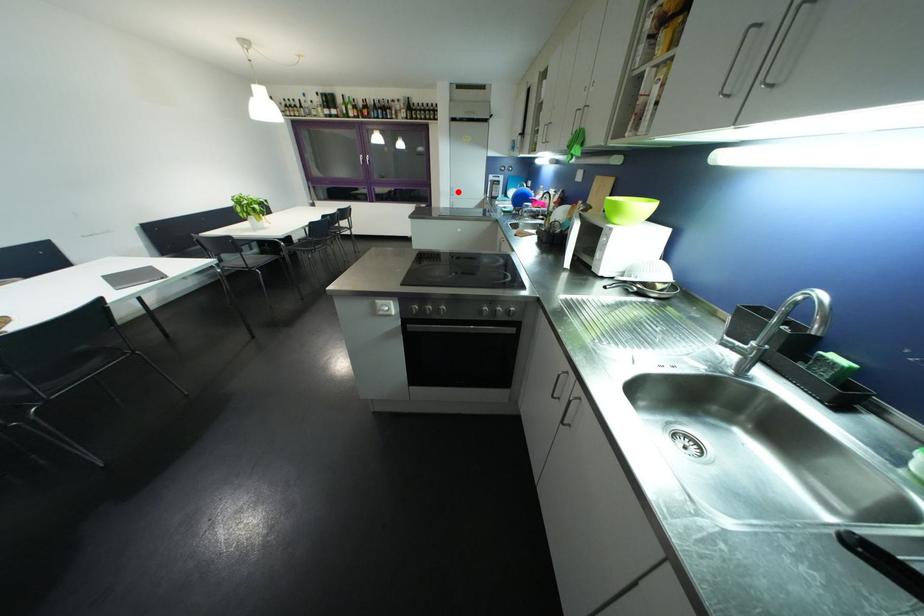
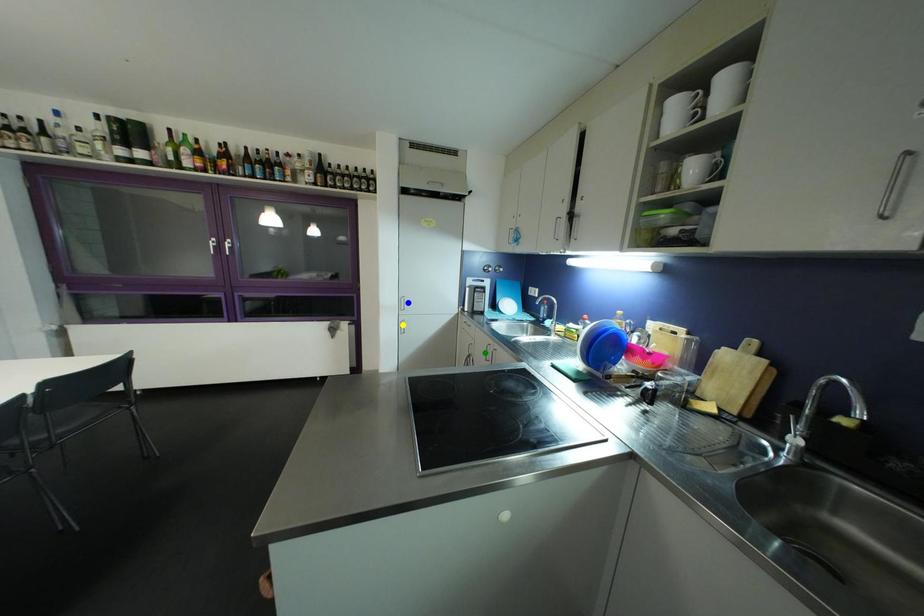
Question: I am providing you with two images of the same scene from different viewpoints. A red point is marked on the first image. You are given multiple points on the second image. Can you choose the point in image 2 that corresponds to the point in image 1?

Choices:
 (A) yellow point
 (B) green point
 (C) blue point

Answer: (C)